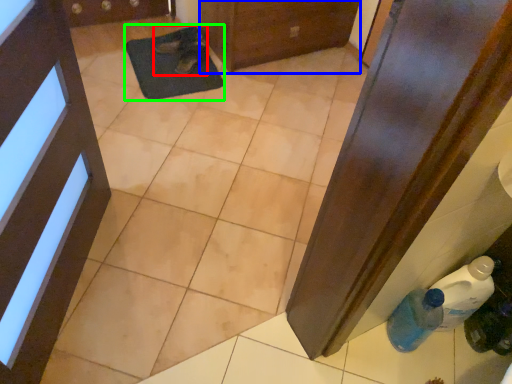
Question: Based on their relative distances, which object is nearer to footwear (highlighted by a red box)? Choose from door (highlighted by a blue box) and mat (highlighted by a green box).

Choices:
 (A) door
 (B) mat

Answer: (B)